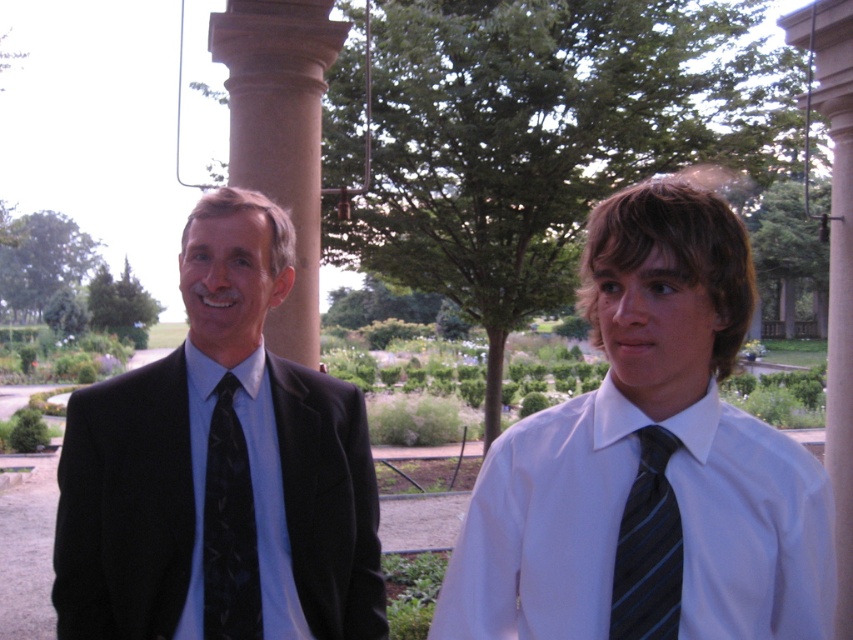
Is point (233, 92) closer to viewer compared to point (248, 628)?

No.

Which is behind, point (311, 205) or point (212, 609)?

Positioned behind is point (311, 205).

Locate an element on the screen. This screenshot has height=640, width=853. brown stone pillar at center is located at coordinates [280, 134].

Does matte black suit at left have a greater height compared to black textured tie at left?

Yes.

The width and height of the screenshot is (853, 640). I want to click on matte black suit at left, so 639,451.

Identify the location of matte black suit at left. Image resolution: width=853 pixels, height=640 pixels. [639, 451].

Who is lower down, matte black suit at left or black matte suit at left?

matte black suit at left is lower down.

Which is above, matte black suit at left or black matte suit at left?

black matte suit at left is above.

Is point (605, 515) positioned after point (314, 573)?

No, (605, 515) is closer to viewer.

Find the location of a particular element. The width and height of the screenshot is (853, 640). matte black suit at left is located at coordinates (639, 451).